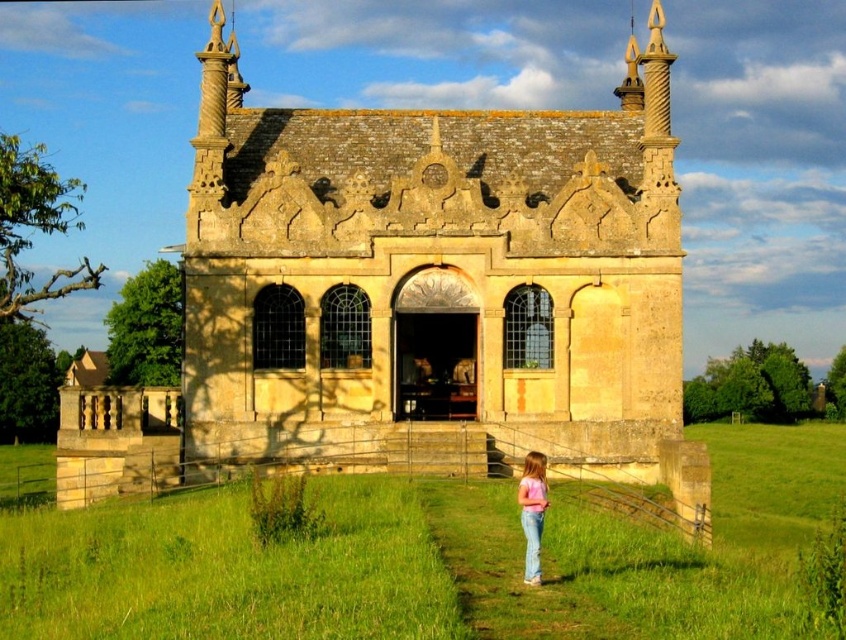
Question: Can you confirm if yellow stone church at center is positioned above pink cotton shirt at lower center?

Choices:
 (A) yes
 (B) no

Answer: (A)

Question: Which point is farther from the camera taking this photo?

Choices:
 (A) (482, 198)
 (B) (146, 502)
 (C) (523, 573)

Answer: (A)

Question: Is yellow stone church at center positioned behind pink cotton shirt at lower center?

Choices:
 (A) no
 (B) yes

Answer: (B)

Question: Considering the real-world distances, which object is farthest from the yellow stone church at center?

Choices:
 (A) green grass at lower center
 (B) pink cotton shirt at lower center

Answer: (B)

Question: Which of the following is the closest to the observer?

Choices:
 (A) pink cotton shirt at lower center
 (B) yellow stone church at center
 (C) green grass at lower center

Answer: (C)

Question: Is yellow stone church at center thinner than green grass at lower center?

Choices:
 (A) no
 (B) yes

Answer: (B)